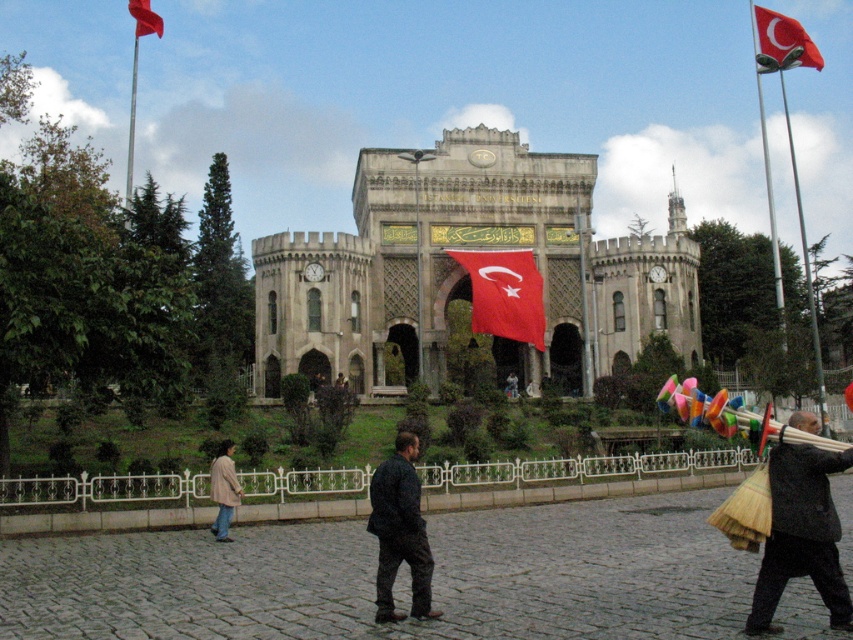
Between point (392, 570) and point (515, 321), which one is positioned in front?

Positioned in front is point (392, 570).

Which is behind, point (389, 568) or point (506, 250)?

The point (506, 250) is behind.

Is point (407, 545) positioned behind point (479, 272)?

No, (407, 545) is closer to viewer.

Image resolution: width=853 pixels, height=640 pixels. What are the coordinates of `dark gray fabric jacket at center` in the screenshot? It's located at (399, 531).

Measure the distance between point (379, 464) and camera.

The distance of point (379, 464) from camera is 89.63 meters.

Where is `dark gray fabric jacket at center`? The image size is (853, 640). dark gray fabric jacket at center is located at coordinates (399, 531).

Can you confirm if red fabric flag at center is positioned to the right of red fabric flag at upper right?

No, red fabric flag at center is not to the right of red fabric flag at upper right.

The width and height of the screenshot is (853, 640). What do you see at coordinates (505, 292) in the screenshot? I see `red fabric flag at center` at bounding box center [505, 292].

Find the location of a particular element. Image resolution: width=853 pixels, height=640 pixels. red fabric flag at center is located at coordinates (505, 292).